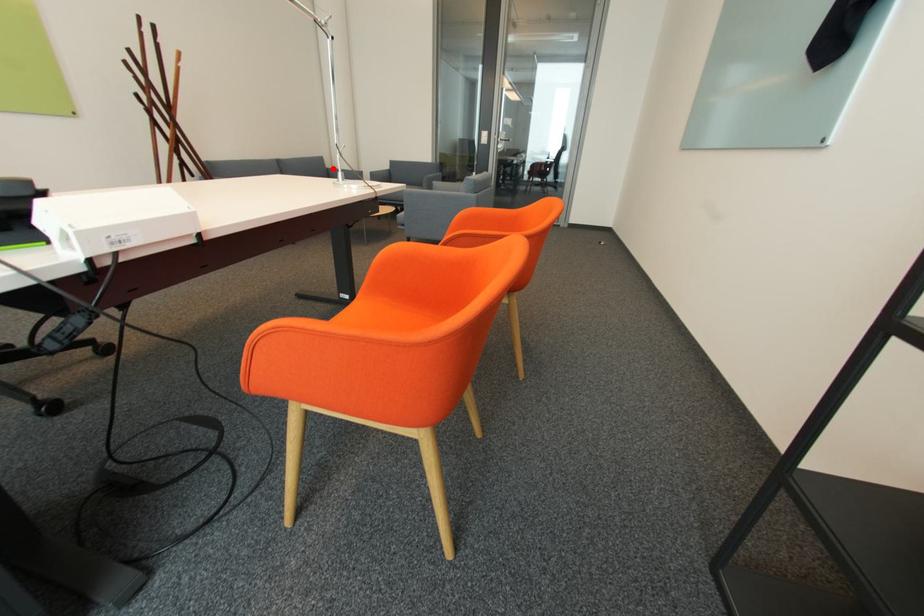
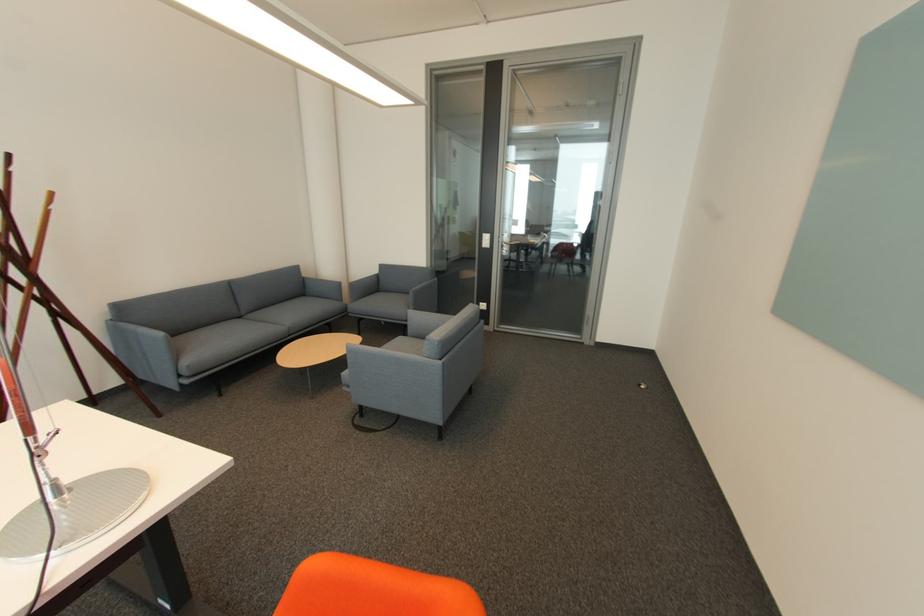
Question: I am providing you with two images of the same scene from different viewpoints. Given a red point in image1, look at the same physical point in image2. Is it:

Choices:
 (A) Closer to the viewpoint
 (B) Farther from the viewpoint

Answer: (A)